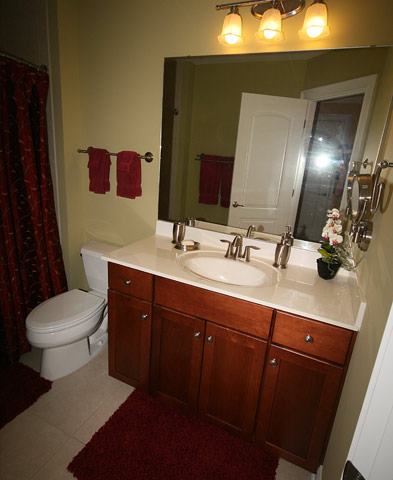
Image resolution: width=393 pixels, height=480 pixels. In order to click on wall in this screenshot , I will do `click(378, 199)`.